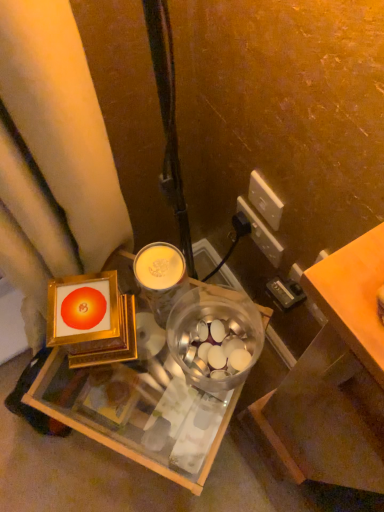
Question: Is gold textured cup at center far away from orange matte table at right?

Choices:
 (A) no
 (B) yes

Answer: (A)

Question: From a real-world perspective, is gold textured cup at center positioned under orange matte table at right based on gravity?

Choices:
 (A) no
 (B) yes

Answer: (B)

Question: Is gold textured cup at center shorter than orange matte table at right?

Choices:
 (A) no
 (B) yes

Answer: (A)

Question: Considering the relative sizes of gold textured cup at center and orange matte table at right in the image provided, is gold textured cup at center thinner than orange matte table at right?

Choices:
 (A) no
 (B) yes

Answer: (A)

Question: Can you confirm if gold textured cup at center is taller than orange matte table at right?

Choices:
 (A) yes
 (B) no

Answer: (A)

Question: Is gold textured cup at center in front of orange matte table at right?

Choices:
 (A) no
 (B) yes

Answer: (A)

Question: Is metallic gold frame at center next to orange matte table at right and touching it?

Choices:
 (A) no
 (B) yes

Answer: (A)

Question: Is metallic gold frame at center wider than orange matte table at right?

Choices:
 (A) no
 (B) yes

Answer: (B)

Question: Is metallic gold frame at center at the left side of orange matte table at right?

Choices:
 (A) yes
 (B) no

Answer: (A)

Question: From the image's perspective, is metallic gold frame at center under orange matte table at right?

Choices:
 (A) yes
 (B) no

Answer: (A)

Question: Is metallic gold frame at center located outside orange matte table at right?

Choices:
 (A) no
 (B) yes

Answer: (B)

Question: Does metallic gold frame at center have a greater height compared to orange matte table at right?

Choices:
 (A) no
 (B) yes

Answer: (B)

Question: From a real-world perspective, is white plastic power outlet at upper right, the first power outlet positioned from the back, over metallic gold frame at center?

Choices:
 (A) yes
 (B) no

Answer: (A)